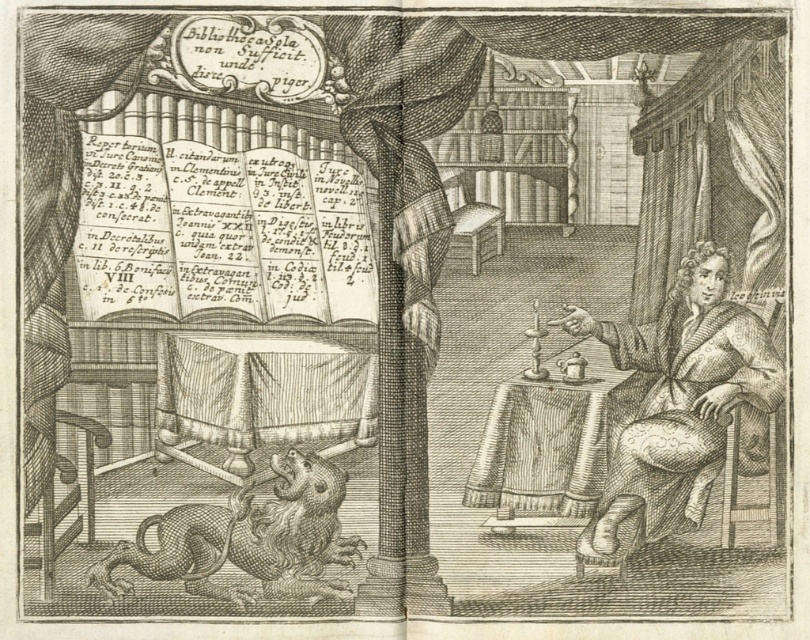
Consider the image. Can you confirm if matte black book at center left is thinner than wooden table at lower right?

In fact, matte black book at center left might be wider than wooden table at lower right.

Is matte black book at center left positioned behind wooden table at lower right?

Yes, it is behind wooden table at lower right.

Between point (92, 188) and point (519, 515), which one is positioned behind?

The point (519, 515) is behind.

The image size is (810, 640). I want to click on matte black book at center left, so click(x=220, y=234).

Which of these two, brown textured lion at lower left or wooden table at lower right, stands shorter?

brown textured lion at lower left

In the scene shown: Which is below, brown textured lion at lower left or wooden table at lower right?

brown textured lion at lower left is lower down.

Is point (143, 534) closer to camera compared to point (595, 394)?

That is True.

This screenshot has height=640, width=810. I want to click on brown textured lion at lower left, so click(x=246, y=538).

Who is taller, smooth brown robe at right or wooden table at lower right?

smooth brown robe at right is taller.

What do you see at coordinates (680, 401) in the screenshot? Image resolution: width=810 pixels, height=640 pixels. I see `smooth brown robe at right` at bounding box center [680, 401].

The height and width of the screenshot is (640, 810). I want to click on smooth brown robe at right, so click(680, 401).